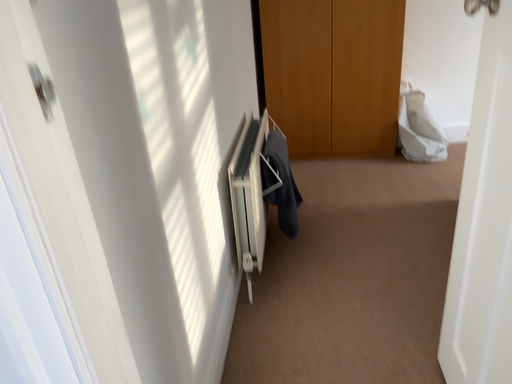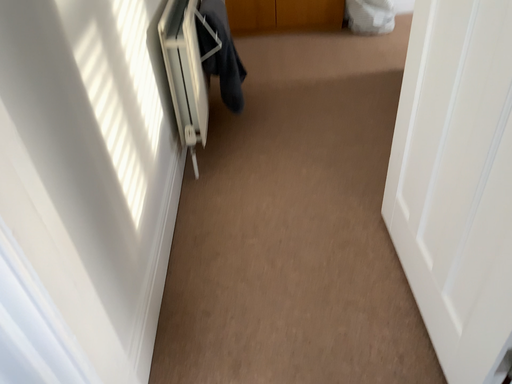
Question: Which way did the camera rotate in the video?

Choices:
 (A) rotated upward
 (B) rotated downward

Answer: (B)